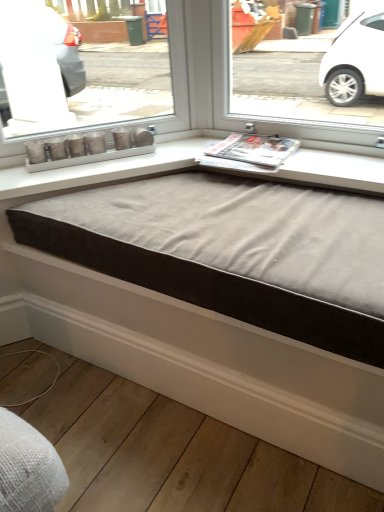
Locate an element on the screen. matte silver candlesticks at center is located at coordinates (88, 148).

Describe the element at coordinates (187, 366) in the screenshot. I see `white wood baseboard at lower center` at that location.

I want to click on matte silver candlesticks at center, so click(x=88, y=148).

Is printed glossy magazine at center bigger or smaller than suede-like fabric bed frame at center?

Considering their sizes, printed glossy magazine at center takes up less space than suede-like fabric bed frame at center.

Based on the photo, is printed glossy magazine at center positioned beyond the bounds of suede-like fabric bed frame at center?

Yes, printed glossy magazine at center is outside of suede-like fabric bed frame at center.

From the image's perspective, who appears lower, printed glossy magazine at center or suede-like fabric bed frame at center?

suede-like fabric bed frame at center appears lower in the image.

Considering the points (296, 139) and (56, 245), which point is behind, point (296, 139) or point (56, 245)?

The point (296, 139) is farther.

Is matte silver candlesticks at center bigger than suede-like fabric bed frame at center?

Incorrect, matte silver candlesticks at center is not larger than suede-like fabric bed frame at center.

Is suede-like fabric bed frame at center completely or partially inside matte silver candlesticks at center?

No, matte silver candlesticks at center does not contain suede-like fabric bed frame at center.

From a real-world perspective, which object stands above the other?

matte silver candlesticks at center.

Is matte silver candlesticks at center far away from suede-like fabric bed frame at center?

That's not correct — matte silver candlesticks at center is a little close to suede-like fabric bed frame at center.

Does matte silver candlesticks at center have a lesser height compared to white wood baseboard at lower center?

Incorrect, the height of matte silver candlesticks at center does not fall short of that of white wood baseboard at lower center.

Is point (126, 143) closer to viewer compared to point (347, 434)?

No, it is behind (347, 434).

Can white wood baseboard at lower center be found inside matte silver candlesticks at center?

No, matte silver candlesticks at center does not contain white wood baseboard at lower center.

Which of these two, matte silver candlesticks at center or white wood baseboard at lower center, is bigger?

white wood baseboard at lower center.

From the image's perspective, is white wood baseboard at lower center over printed glossy magazine at center?

No, from the image's perspective, white wood baseboard at lower center is not above printed glossy magazine at center.

Does white wood baseboard at lower center have a smaller size compared to printed glossy magazine at center?

No.

From a real-world perspective, is white wood baseboard at lower center located higher than printed glossy magazine at center?

No, from a real-world perspective, white wood baseboard at lower center is not over printed glossy magazine at center

Considering the relative positions of white wood baseboard at lower center and matte silver candlesticks at center in the image provided, is white wood baseboard at lower center to the left of matte silver candlesticks at center from the viewer's perspective?

No.

Can you tell me how much white wood baseboard at lower center and matte silver candlesticks at center differ in facing direction?

140 degrees separate the facing orientations of white wood baseboard at lower center and matte silver candlesticks at center.

In the scene shown: Can we say white wood baseboard at lower center lies outside matte silver candlesticks at center?

Yes, white wood baseboard at lower center is not within matte silver candlesticks at center.

Which of these two, white wood baseboard at lower center or matte silver candlesticks at center, stands taller?

matte silver candlesticks at center.

Do you think suede-like fabric bed frame at center is within printed glossy magazine at center, or outside of it?

suede-like fabric bed frame at center is not enclosed by printed glossy magazine at center.

From a real-world perspective, is suede-like fabric bed frame at center physically located above or below printed glossy magazine at center?

From a real-world perspective, suede-like fabric bed frame at center is physically below printed glossy magazine at center.

Is suede-like fabric bed frame at center taller or shorter than printed glossy magazine at center?

Considering their sizes, suede-like fabric bed frame at center has less height than printed glossy magazine at center.

Considering the sizes of suede-like fabric bed frame at center and printed glossy magazine at center in the image, is suede-like fabric bed frame at center wider or thinner than printed glossy magazine at center?

Clearly, suede-like fabric bed frame at center has more width compared to printed glossy magazine at center.

From a real-world perspective, which is physically below, matte silver candlesticks at center or printed glossy magazine at center?

In real-world perspective, printed glossy magazine at center is lower.

Consider the image. Is matte silver candlesticks at center spatially inside printed glossy magazine at center, or outside of it?

matte silver candlesticks at center exists outside the volume of printed glossy magazine at center.

From the image's perspective, is matte silver candlesticks at center below printed glossy magazine at center?

Yes, from the image's perspective, matte silver candlesticks at center is below printed glossy magazine at center.

Looking at their sizes, would you say matte silver candlesticks at center is wider or thinner than printed glossy magazine at center?

Clearly, matte silver candlesticks at center has less width compared to printed glossy magazine at center.

There is a suede-like fabric bed frame at center. Identify the location of magazine above it (from a real-world perspective). The image size is (384, 512). (250, 152).

The height and width of the screenshot is (512, 384). I want to click on bed frame lying on the right of matte silver candlesticks at center, so click(221, 303).

When comparing their distances from matte silver candlesticks at center, does suede-like fabric bed frame at center or printed glossy magazine at center seem closer?

printed glossy magazine at center is closer to matte silver candlesticks at center.

Based on their spatial positions, is printed glossy magazine at center or suede-like fabric bed frame at center further from white wood baseboard at lower center?

The object further to white wood baseboard at lower center is printed glossy magazine at center.

Which object lies further to the anchor point matte silver candlesticks at center, suede-like fabric bed frame at center or white wood baseboard at lower center?

Among the two, white wood baseboard at lower center is located further to matte silver candlesticks at center.

Which object lies further to the anchor point suede-like fabric bed frame at center, printed glossy magazine at center or white wood baseboard at lower center?

printed glossy magazine at center is positioned further to the anchor suede-like fabric bed frame at center.

Which object lies nearer to the anchor point printed glossy magazine at center, matte silver candlesticks at center or white wood baseboard at lower center?

matte silver candlesticks at center is closer to printed glossy magazine at center.

Considering their positions, is white wood baseboard at lower center positioned further to matte silver candlesticks at center than printed glossy magazine at center?

white wood baseboard at lower center is positioned further to the anchor matte silver candlesticks at center.

Based on their spatial positions, is suede-like fabric bed frame at center or matte silver candlesticks at center closer to white wood baseboard at lower center?

Among the two, suede-like fabric bed frame at center is located nearer to white wood baseboard at lower center.

Estimate the real-world distances between objects in this image. Which object is further from matte silver candlesticks at center, printed glossy magazine at center or white wood baseboard at lower center?

The object further to matte silver candlesticks at center is white wood baseboard at lower center.

This screenshot has width=384, height=512. Identify the location of magazine located between suede-like fabric bed frame at center and matte silver candlesticks at center in the depth direction. (250, 152).

Find the location of a particular element. The height and width of the screenshot is (512, 384). bed frame between printed glossy magazine at center and white wood baseboard at lower center in the vertical direction is located at coordinates (221, 303).

Where is `window box between printed glossy magazine at center and white wood baseboard at lower center vertically`? The height and width of the screenshot is (512, 384). window box between printed glossy magazine at center and white wood baseboard at lower center vertically is located at coordinates (88, 148).

Locate an element on the screen. bed frame between matte silver candlesticks at center and white wood baseboard at lower center from top to bottom is located at coordinates (221, 303).